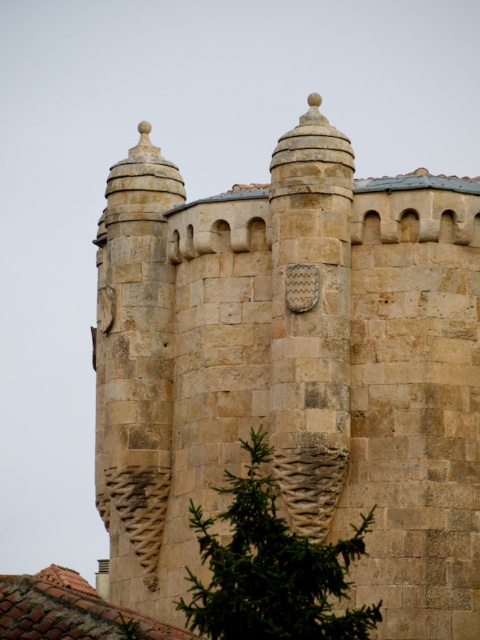
Question: From the image, what is the correct spatial relationship of stone textured castle at center in relation to green textured stone at center?

Choices:
 (A) left
 (B) right

Answer: (A)

Question: Does stone textured castle at center appear on the right side of green textured stone at center?

Choices:
 (A) no
 (B) yes

Answer: (A)

Question: Is stone textured castle at center bigger than green textured stone at center?

Choices:
 (A) no
 (B) yes

Answer: (B)

Question: Which of the following is the farthest from the observer?

Choices:
 (A) (300, 557)
 (B) (269, 340)

Answer: (B)

Question: Which point appears closest to the camera in this image?

Choices:
 (A) (465, 582)
 (B) (248, 556)

Answer: (B)